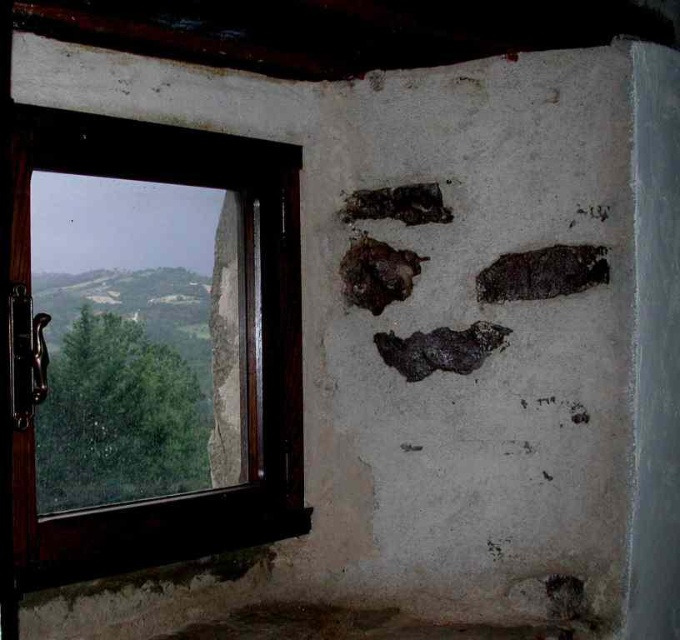
Describe the element at coordinates (243, 346) in the screenshot. I see `brown wooden window at left` at that location.

Looking at this image, can you confirm if brown wooden window at left is taller than dark textured rock at upper right?

Correct, brown wooden window at left is much taller as dark textured rock at upper right.

Who is more distant from viewer, (54, 573) or (602, 266)?

The point (602, 266) is behind.

Identify the location of brown wooden window at left. (243, 346).

Is dark textured rock at upper right further to camera compared to charcoal textured footprint at upper center?

No.

Does dark textured rock at upper right appear on the left side of charcoal textured footprint at upper center?

No, dark textured rock at upper right is not to the left of charcoal textured footprint at upper center.

Between point (513, 300) and point (343, 220), which one is positioned behind?

Point (343, 220)

Where is `dark textured rock at upper right`? The image size is (680, 640). dark textured rock at upper right is located at coordinates (543, 273).

Between dark textured rock at center and charcoal textured footprint at upper center, which one has more height?

dark textured rock at center

Is dark textured rock at center positioned at the back of charcoal textured footprint at upper center?

No, dark textured rock at center is in front of charcoal textured footprint at upper center.

Does point (447, 344) lie in front of point (392, 212)?

That is True.

Image resolution: width=680 pixels, height=640 pixels. What are the coordinates of `dark textured rock at center` in the screenshot? It's located at (439, 348).